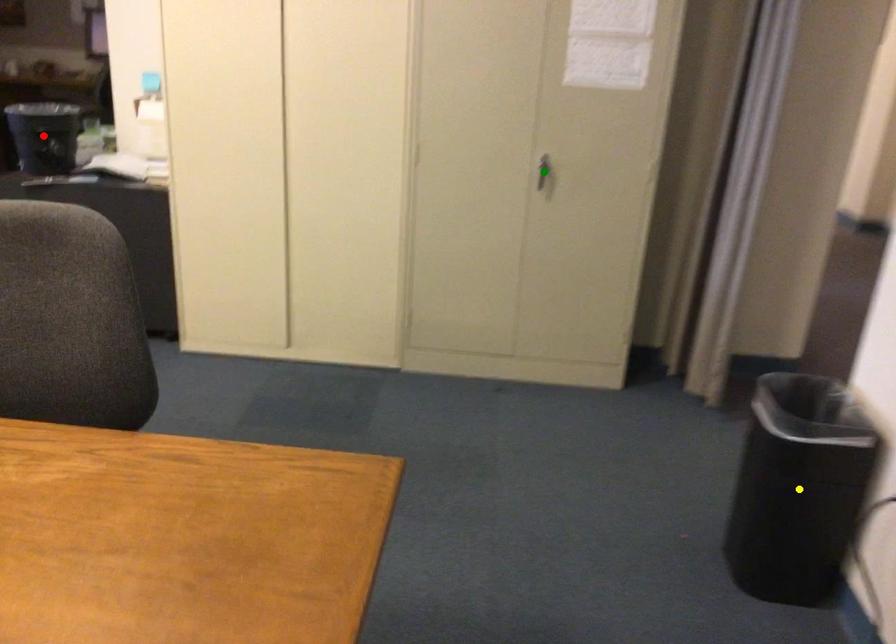
Order these from nearest to farthest:
- green point
- yellow point
- red point

yellow point < green point < red point